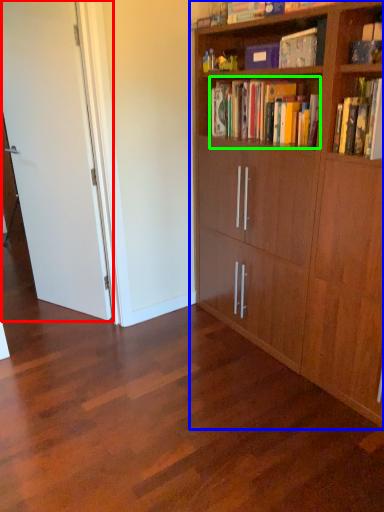
Question: Which is nearer to the door (highlighted by a red box)? bookcase (highlighted by a blue box) or book (highlighted by a green box).

Choices:
 (A) bookcase
 (B) book

Answer: (A)